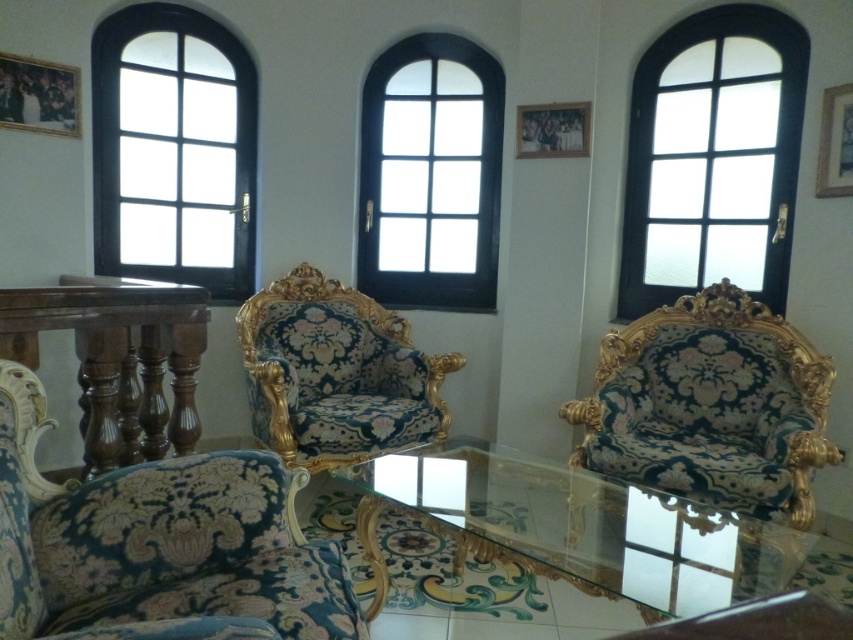
Question: Which point is closer to the camera?

Choices:
 (A) velvet/goldenobject at right
 (B) velvet/goldenchair at center
 (C) wooden picture frame at upper right

Answer: (A)

Question: Is black glass window at left closer to the viewer compared to polished wood table at left?

Choices:
 (A) yes
 (B) no

Answer: (B)

Question: From the image, what is the correct spatial relationship of polished wood table at left in relation to wooden picture frame at upper right?

Choices:
 (A) right
 (B) left

Answer: (B)

Question: Which point appears farthest from the camera in this image?

Choices:
 (A) (396, 140)
 (B) (138, 364)
 (C) (589, 461)

Answer: (A)

Question: Is velvet upholstery chair at center smaller than black glass window at left?

Choices:
 (A) yes
 (B) no

Answer: (A)

Question: Which object is positioned farthest from the polished wood table at left?

Choices:
 (A) matte black window at upper right
 (B) wooden picture frame at upper right

Answer: (B)